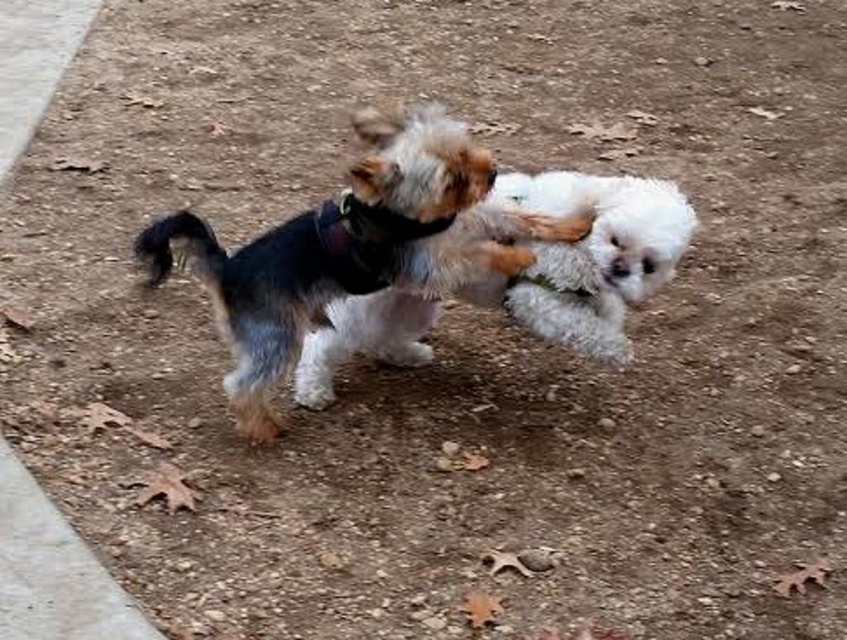
Is soft fur dog at center bigger than fluffy white dog at center?

Indeed, soft fur dog at center has a larger size compared to fluffy white dog at center.

Who is more distant from viewer, (408, 211) or (547, 260)?

Point (547, 260)

Image resolution: width=847 pixels, height=640 pixels. I want to click on soft fur dog at center, so click(353, 248).